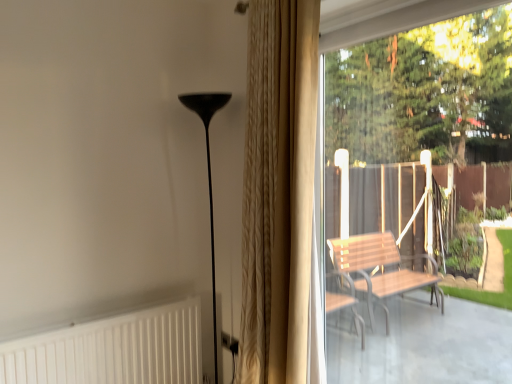
This screenshot has width=512, height=384. Describe the element at coordinates (208, 172) in the screenshot. I see `matte black floor lamp at center` at that location.

What is the approximate width of beige textured curtain at center?

27.82 centimeters.

What are the coordinates of `white textured radiator at lower left` in the screenshot? It's located at (113, 350).

Where is `wooden bench at right`? The height and width of the screenshot is (384, 512). wooden bench at right is located at coordinates (419, 137).

Would you say beige textured curtain at center is part of wooden bench at right's contents?

No, wooden bench at right does not contain beige textured curtain at center.

From a real-world perspective, is wooden bench at right located higher than beige textured curtain at center?

No.

Who is bigger, wooden bench at right or beige textured curtain at center?

Bigger between the two is beige textured curtain at center.

Considering the relative sizes of wooden bench at right and beige textured curtain at center in the image provided, is wooden bench at right thinner than beige textured curtain at center?

Indeed, wooden bench at right has a lesser width compared to beige textured curtain at center.

Would you say wooden bench at right is to the left or to the right of white textured radiator at lower left in the picture?

wooden bench at right is to the right of white textured radiator at lower left.

Looking at the image, does wooden bench at right seem bigger or smaller compared to white textured radiator at lower left?

In the image, wooden bench at right appears to be smaller than white textured radiator at lower left.

Consider the image. From a real-world perspective, does wooden bench at right sit lower than white textured radiator at lower left?

No.

Is point (435, 53) closer or farther from the camera than point (215, 311)?

Point (435, 53) appears to be farther away from the viewer than point (215, 311).

From the image's perspective, would you say wooden bench at right is positioned over matte black floor lamp at center?

Yes.

Is wooden bench at right to the right of matte black floor lamp at center from the viewer's perspective?

Indeed, wooden bench at right is positioned on the right side of matte black floor lamp at center.

Is wooden bench at right bigger or smaller than matte black floor lamp at center?

Considering their sizes, wooden bench at right takes up less space than matte black floor lamp at center.

Can you confirm if beige textured curtain at center is positioned to the right of white textured radiator at lower left?

Indeed, beige textured curtain at center is positioned on the right side of white textured radiator at lower left.

Are beige textured curtain at center and white textured radiator at lower left located far from each other?

No, beige textured curtain at center is not far from white textured radiator at lower left.

Which object is closer to the camera, beige textured curtain at center or white textured radiator at lower left?

beige textured curtain at center is in front.

At what (x,y) coordinates should I click in order to perform the action: click on curtain above the white textured radiator at lower left (from a real-world perspective). Please return your answer as a coordinate pair (x, y). The image size is (512, 384). Looking at the image, I should click on (278, 191).

Does matte black floor lamp at center appear on the right side of white textured radiator at lower left?

Yes.

What's the angular difference between matte black floor lamp at center and white textured radiator at lower left's facing directions?

There is a 91.1-degree angle between the facing directions of matte black floor lamp at center and white textured radiator at lower left.

Image resolution: width=512 pixels, height=384 pixels. Find the location of `radiator below the matte black floor lamp at center (from the image's perspective)`. radiator below the matte black floor lamp at center (from the image's perspective) is located at coordinates (113, 350).

How much distance is there between matte black floor lamp at center and white textured radiator at lower left?

24.47 inches.

Looking at this image, which of these two, white textured radiator at lower left or wooden bench at right, stands shorter?

With less height is white textured radiator at lower left.

You are a GUI agent. You are given a task and a screenshot of the screen. Output one action in this format:
    pyautogui.click(x=<x>, y=<y>)
    Task: Click on the window screen lying in front of the white textured radiator at lower left
    This screenshot has height=384, width=512.
    Given the screenshot: What is the action you would take?
    (x=419, y=137)

Is white textured radiator at lower left at the left side of wooden bench at right?

Correct, you'll find white textured radiator at lower left to the left of wooden bench at right.

Considering the relative sizes of white textured radiator at lower left and wooden bench at right in the image provided, is white textured radiator at lower left wider than wooden bench at right?

Correct, the width of white textured radiator at lower left exceeds that of wooden bench at right.

Can you confirm if beige textured curtain at center is shorter than matte black floor lamp at center?

Incorrect, the height of beige textured curtain at center does not fall short of that of matte black floor lamp at center.

In the scene shown: Is beige textured curtain at center inside the boundaries of matte black floor lamp at center, or outside?

beige textured curtain at center cannot be found inside matte black floor lamp at center.

From a real-world perspective, between beige textured curtain at center and matte black floor lamp at center, who is vertically higher?

beige textured curtain at center, from a real-world perspective.

Considering the relative positions of beige textured curtain at center and matte black floor lamp at center in the image provided, is beige textured curtain at center to the left of matte black floor lamp at center from the viewer's perspective?

No.

At what (x,y) coordinates should I click in order to perform the action: click on curtain located on the left of wooden bench at right. Please return your answer as a coordinate pair (x, y). Image resolution: width=512 pixels, height=384 pixels. Looking at the image, I should click on point(278,191).

Where is `radiator lying behind the wooden bench at right`? radiator lying behind the wooden bench at right is located at coordinates (113, 350).

Estimate the real-world distances between objects in this image. Which object is further from matte black floor lamp at center, wooden bench at right or beige textured curtain at center?

wooden bench at right lies further to matte black floor lamp at center than the other object.

From the image, which object appears to be nearer to matte black floor lamp at center, white textured radiator at lower left or wooden bench at right?

white textured radiator at lower left is closer to matte black floor lamp at center.

Based on their spatial positions, is wooden bench at right or white textured radiator at lower left closer to matte black floor lamp at center?

The object closer to matte black floor lamp at center is white textured radiator at lower left.

Estimate the real-world distances between objects in this image. Which object is closer to matte black floor lamp at center, white textured radiator at lower left or beige textured curtain at center?

Among the two, white textured radiator at lower left is located nearer to matte black floor lamp at center.

Estimate the real-world distances between objects in this image. Which object is closer to wooden bench at right, beige textured curtain at center or white textured radiator at lower left?

Among the two, white textured radiator at lower left is located nearer to wooden bench at right.

Considering their positions, is matte black floor lamp at center positioned closer to wooden bench at right than beige textured curtain at center?

beige textured curtain at center lies closer to wooden bench at right than the other object.

Based on their spatial positions, is wooden bench at right or matte black floor lamp at center further from white textured radiator at lower left?

The object further to white textured radiator at lower left is wooden bench at right.

Considering their positions, is white textured radiator at lower left positioned closer to beige textured curtain at center than matte black floor lamp at center?

Based on the image, matte black floor lamp at center appears to be nearer to beige textured curtain at center.

You are a GUI agent. You are given a task and a screenshot of the screen. Output one action in this format:
    pyautogui.click(x=<x>, y=<y>)
    Task: Click on the curtain situated between matte black floor lamp at center and wooden bench at right from left to right
    This screenshot has width=512, height=384.
    Given the screenshot: What is the action you would take?
    pyautogui.click(x=278, y=191)

Locate an element on the screen. This screenshot has width=512, height=384. lamp situated between white textured radiator at lower left and wooden bench at right from left to right is located at coordinates (208, 172).

Locate an element on the screen. lamp that lies between beige textured curtain at center and white textured radiator at lower left from top to bottom is located at coordinates (208, 172).

Find the location of a particular element. This screenshot has width=512, height=384. curtain located between white textured radiator at lower left and wooden bench at right in the left-right direction is located at coordinates (278, 191).